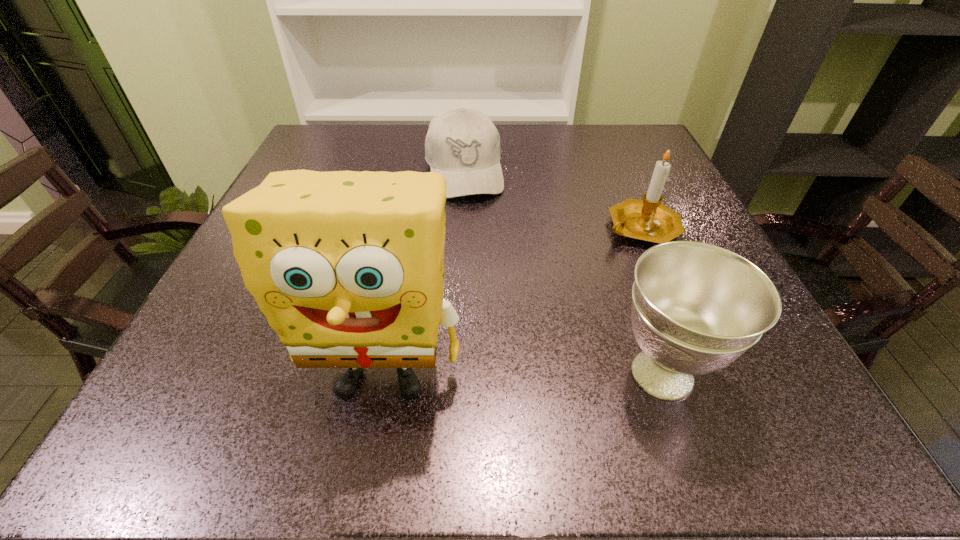
Locate an element on the screen. The image size is (960, 540). the tallest object is located at coordinates (348, 267).

Locate an element on the screen. The image size is (960, 540). chalice is located at coordinates (696, 307).

Locate an element on the screen. candle holder is located at coordinates (648, 220).

Where is `the farthest object`? the farthest object is located at coordinates (463, 145).

The width and height of the screenshot is (960, 540). I want to click on baseball cap, so click(463, 145).

You are a GUI agent. You are given a task and a screenshot of the screen. Output one action in this format:
    pyautogui.click(x=<x>, y=<y>)
    Task: Click on the free point located 0.290m on the back of the chalice
    This screenshot has width=960, height=540.
    Given the screenshot: What is the action you would take?
    pyautogui.click(x=610, y=222)

Find the location of a particular element. This screenshot has width=960, height=540. free region located 0.290m with a handle on the third nearest object is located at coordinates (564, 349).

Locate an element on the screen. free space located with a handle on the third nearest object is located at coordinates (550, 372).

Locate an element on the screen. vacant space situated with a handle on the third nearest object is located at coordinates (553, 367).

Where is `vacant space located on the front-facing side of the farthest object`? vacant space located on the front-facing side of the farthest object is located at coordinates (470, 217).